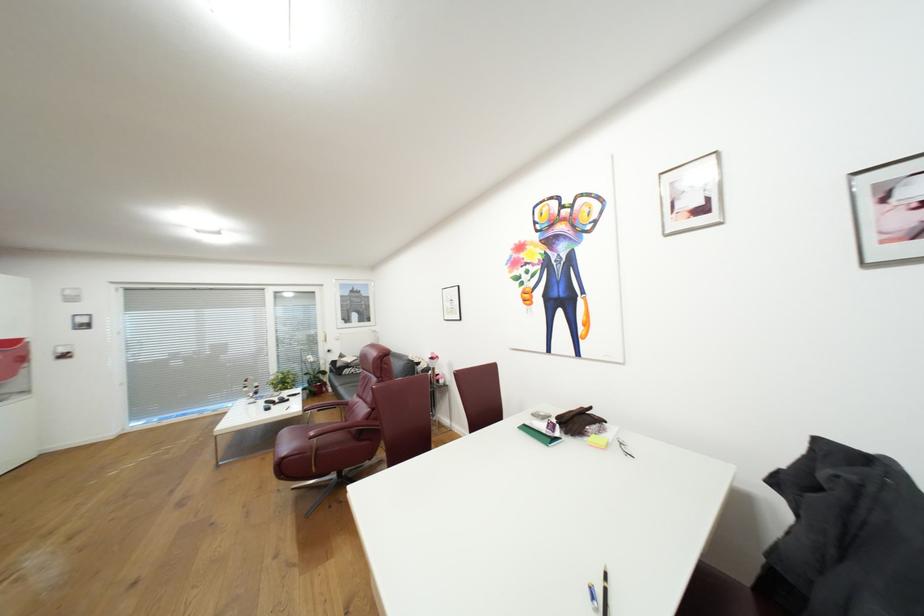
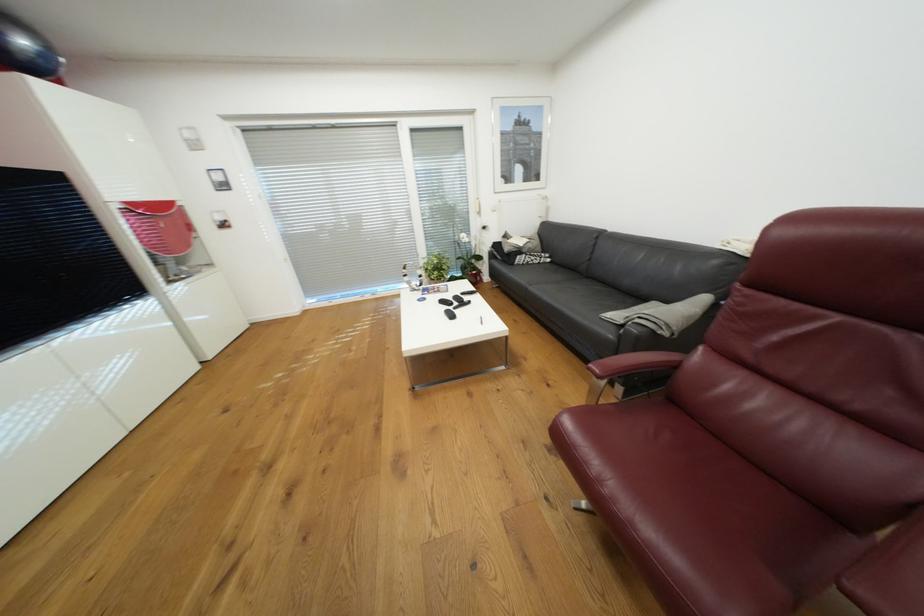
In the second image, find the point that corresponds to the point at 354,365 in the first image.

(526, 252)